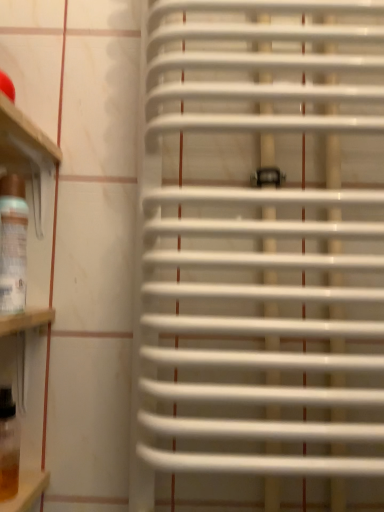
Question: Considering the relative sizes of translucent glass wine bottle at left, the first wine bottle when ordered from top to bottom, and white plastic radiator at center in the image provided, is translucent glass wine bottle at left, the first wine bottle when ordered from top to bottom, bigger than white plastic radiator at center?

Choices:
 (A) no
 (B) yes

Answer: (A)

Question: From a real-world perspective, is translucent glass wine bottle at left, the first wine bottle when ordered from top to bottom, under white plastic radiator at center?

Choices:
 (A) no
 (B) yes

Answer: (B)

Question: Is translucent glass wine bottle at left, which is counted as the 2th wine bottle, starting from the bottom, positioned in front of white plastic radiator at center?

Choices:
 (A) no
 (B) yes

Answer: (A)

Question: Would you say white plastic radiator at center is part of translucent glass wine bottle at left, the first wine bottle when ordered from top to bottom,'s contents?

Choices:
 (A) yes
 (B) no

Answer: (B)

Question: Is translucent glass wine bottle at left, which is counted as the 2th wine bottle, starting from the bottom, taller than white plastic radiator at center?

Choices:
 (A) no
 (B) yes

Answer: (A)

Question: Considering the relative sizes of translucent glass wine bottle at left, which is counted as the 2th wine bottle, starting from the bottom, and white plastic radiator at center in the image provided, is translucent glass wine bottle at left, which is counted as the 2th wine bottle, starting from the bottom, thinner than white plastic radiator at center?

Choices:
 (A) no
 (B) yes

Answer: (B)

Question: Considering the relative positions of white plastic radiator at center and translucent amber glass at lower left, placed as the first wine bottle when sorted from bottom to top, in the image provided, is white plastic radiator at center to the left of translucent amber glass at lower left, placed as the first wine bottle when sorted from bottom to top, from the viewer's perspective?

Choices:
 (A) yes
 (B) no

Answer: (B)

Question: Is white plastic radiator at center shorter than translucent amber glass at lower left, placed as the first wine bottle when sorted from bottom to top?

Choices:
 (A) no
 (B) yes

Answer: (A)

Question: Can you confirm if white plastic radiator at center is smaller than translucent amber glass at lower left, placed as the first wine bottle when sorted from bottom to top?

Choices:
 (A) no
 (B) yes

Answer: (A)

Question: From the image's perspective, is white plastic radiator at center located beneath translucent amber glass at lower left, the 2th wine bottle viewed from the top?

Choices:
 (A) no
 (B) yes

Answer: (A)

Question: Can you confirm if white plastic radiator at center is thinner than translucent amber glass at lower left, the 2th wine bottle viewed from the top?

Choices:
 (A) yes
 (B) no

Answer: (B)

Question: Is white plastic radiator at center turned away from translucent amber glass at lower left, the 2th wine bottle viewed from the top?

Choices:
 (A) no
 (B) yes

Answer: (A)

Question: Is translucent glass wine bottle at left, which is counted as the 2th wine bottle, starting from the bottom, with translucent amber glass at lower left, placed as the first wine bottle when sorted from bottom to top?

Choices:
 (A) yes
 (B) no

Answer: (B)